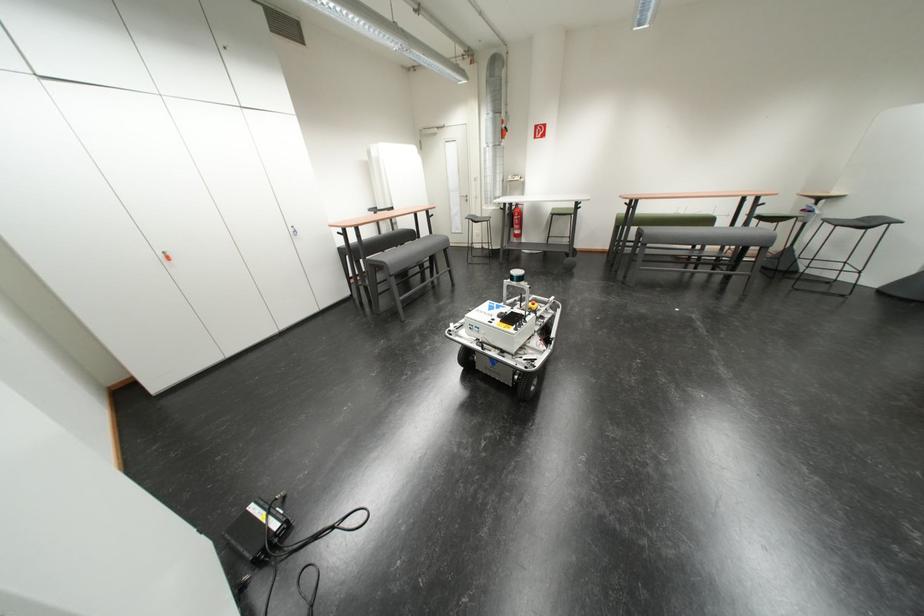
Describe the element at coordinates (166, 256) in the screenshot. I see `the orange cabinet handle` at that location.